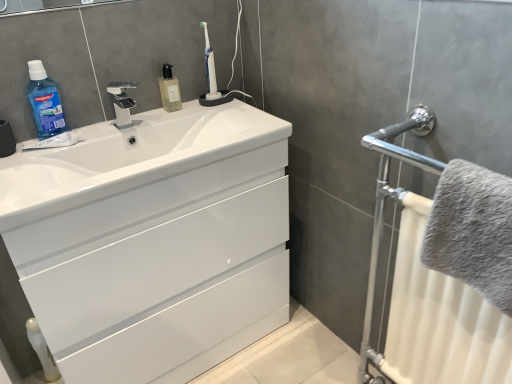
Question: Is gray fluffy towel at right bigger or smaller than blue translucent liquid at upper left?

Choices:
 (A) small
 (B) big

Answer: (B)

Question: In terms of height, does gray fluffy towel at right look taller or shorter compared to blue translucent liquid at upper left?

Choices:
 (A) tall
 (B) short

Answer: (A)

Question: Which object is positioned closest to the white glossy sink at center?

Choices:
 (A) gray fluffy towel at right
 (B) white glossy cabinet at center
 (C) translucent glass soap dispenser at upper center
 (D) white plastic toothbrush at upper center
 (E) blue translucent liquid at upper left

Answer: (B)

Question: Which of these objects is positioned farthest from the polished chrome tap at upper center?

Choices:
 (A) white plastic toothbrush at upper center
 (B) white glossy sink at center
 (C) white glossy cabinet at center
 (D) blue translucent liquid at upper left
 (E) translucent glass soap dispenser at upper center

Answer: (C)